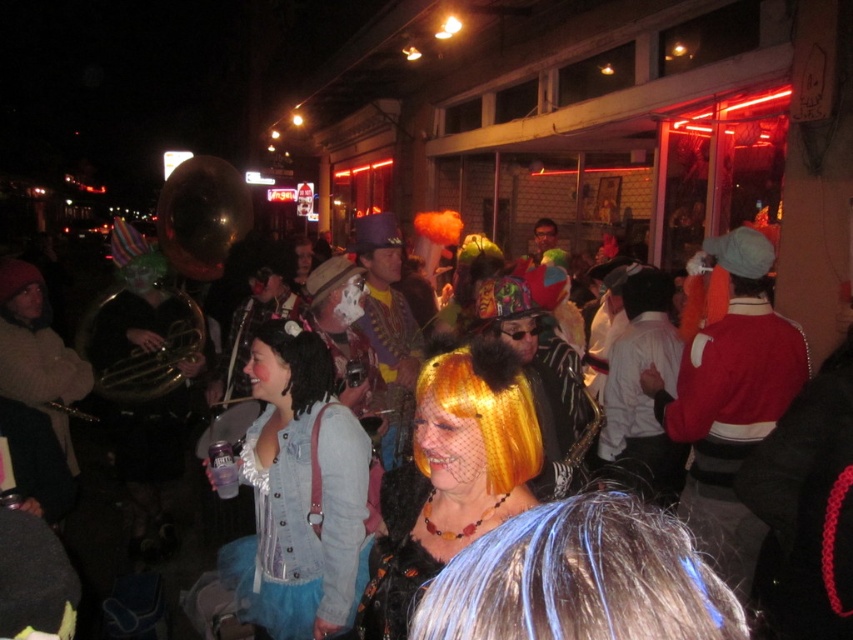
Is shiny gold wig at center shorter than red velvet jacket at right?

Correct, shiny gold wig at center is not as tall as red velvet jacket at right.

Is shiny gold wig at center closer to camera compared to red velvet jacket at right?

Yes.

Which is behind, point (413, 541) or point (715, 410)?

The point (715, 410) is behind.

You are a GUI agent. You are given a task and a screenshot of the screen. Output one action in this format:
    pyautogui.click(x=<x>, y=<y>)
    Task: Click on the shiny gold wig at center
    
    Given the screenshot: What is the action you would take?
    pyautogui.click(x=451, y=476)

Who is higher up, denim jacket at center or shiny orange wig at center?

Positioned higher is shiny orange wig at center.

Does point (222, 576) lie in front of point (444, 376)?

That is False.

Find the location of a particular element. The height and width of the screenshot is (640, 853). denim jacket at center is located at coordinates (299, 493).

Image resolution: width=853 pixels, height=640 pixels. Describe the element at coordinates (299, 493) in the screenshot. I see `denim jacket at center` at that location.

Which is in front, point (346, 458) or point (370, 634)?

Point (370, 634) is more forward.

Between point (250, 365) and point (442, 531), which one is positioned in front?

Point (442, 531)

You are a GUI agent. You are given a task and a screenshot of the screen. Output one action in this format:
    pyautogui.click(x=<x>, y=<y>)
    Task: Click on the denim jacket at center
    The height and width of the screenshot is (640, 853).
    Given the screenshot: What is the action you would take?
    pyautogui.click(x=299, y=493)